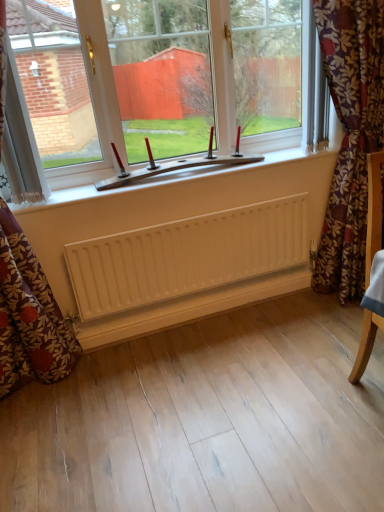
Question: From a real-world perspective, is white plastic window at center physically located above or below white matte radiator at center?

Choices:
 (A) below
 (B) above

Answer: (B)

Question: Considering the positions of white plastic window at center and white matte radiator at center in the image, is white plastic window at center taller or shorter than white matte radiator at center?

Choices:
 (A) tall
 (B) short

Answer: (A)

Question: Which of these objects is positioned farthest from the floral fabric curtain at right, the first curtain when ordered from right to left?

Choices:
 (A) white textured curtain at left, marked as the 1th curtain in a left-to-right arrangement
 (B) white plastic window at center
 (C) white matte radiator at center
 (D) floral fabric curtain at left, positioned as the 2th curtain in left-to-right order

Answer: (D)

Question: Based on their relative distances, which object is farther from the white plastic window at center?

Choices:
 (A) white matte radiator at center
 (B) floral fabric curtain at left, positioned as the 2th curtain in left-to-right order
 (C) floral fabric curtain at right, the first curtain when ordered from right to left
 (D) white textured curtain at left, marked as the 1th curtain in a left-to-right arrangement

Answer: (B)